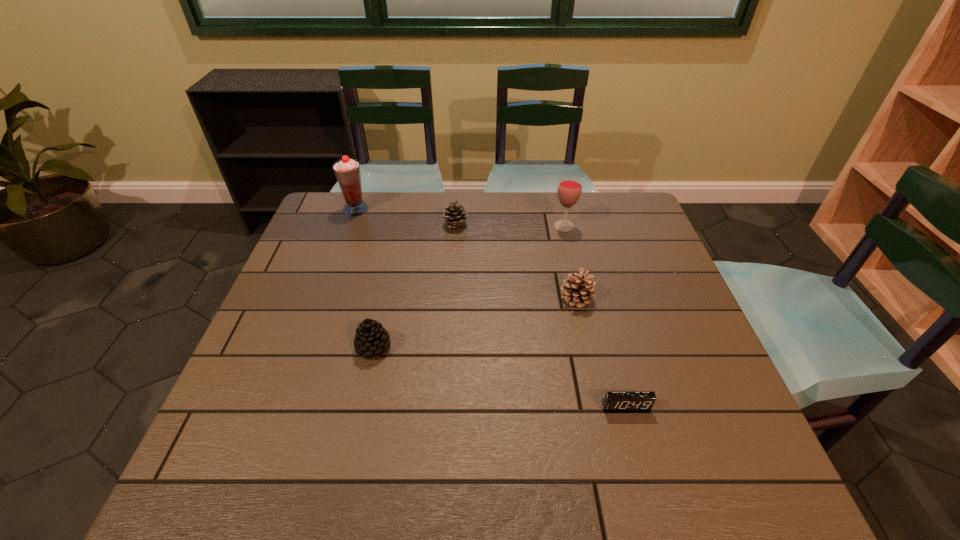
Identify the location of the shortest object. The height and width of the screenshot is (540, 960). (614, 400).

What are the coordinates of `free spot located on the front of the leftmost object` in the screenshot? It's located at (347, 236).

At what (x,y) coordinates should I click in order to perform the action: click on vacant position located on the right of the second tallest object. Please return your answer as a coordinate pair (x, y). The width and height of the screenshot is (960, 540). Looking at the image, I should click on (595, 226).

Identify the location of vacant space located on the back of the rightmost pinecone. (559, 221).

This screenshot has height=540, width=960. Identify the location of vacant region located 0.240m at the narrow end of the fifth farthest object. (493, 347).

Find the location of a particular element. The width and height of the screenshot is (960, 540). vacant space located 0.200m on the right of the second pinecone from left to right is located at coordinates (532, 224).

The image size is (960, 540). What are the coordinates of `vacant point located on the front-facing side of the nearest object` in the screenshot? It's located at (636, 444).

The width and height of the screenshot is (960, 540). I want to click on smoothie that is at the far edge, so click(347, 171).

This screenshot has width=960, height=540. I want to click on wineglass that is at the far edge, so click(569, 189).

This screenshot has height=540, width=960. I want to click on pinecone located in the far edge section of the desktop, so click(x=454, y=216).